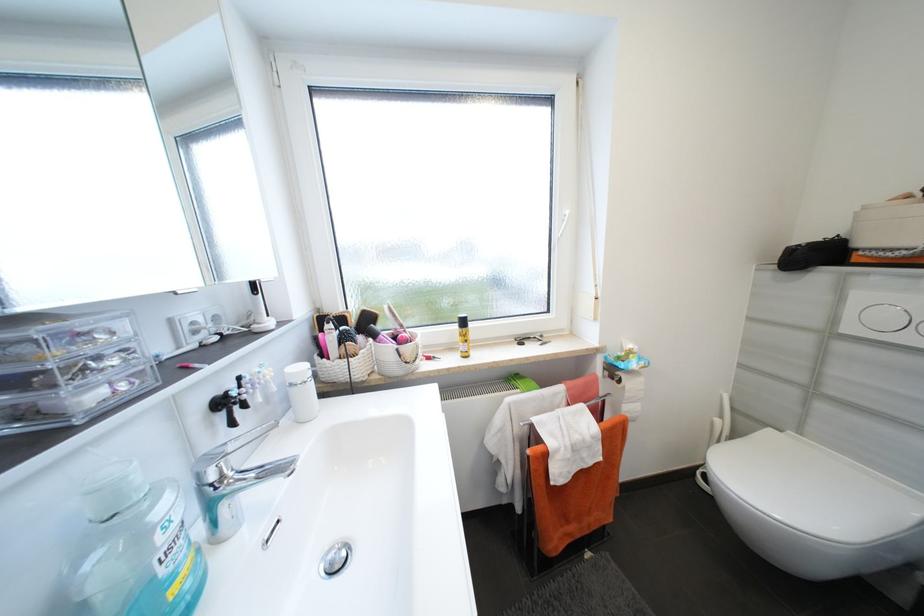
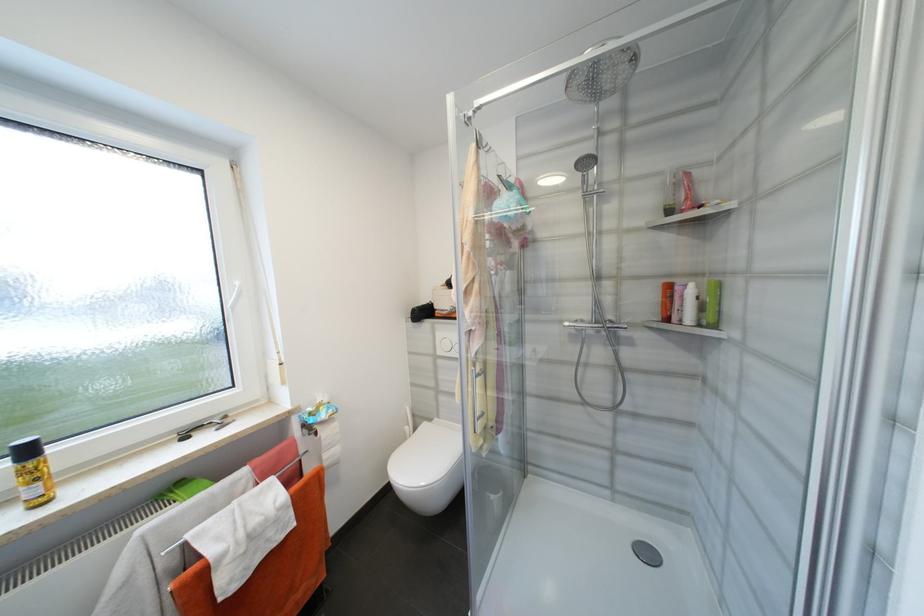
Where in the second image is the point corresponding to (469,323) from the first image?

(33, 453)